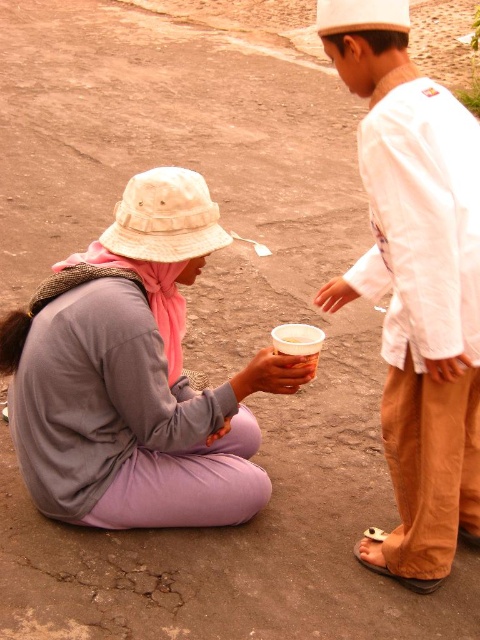
You are a delivery person who needs to deliver a package to the taller object between the purple fabric at lower left and the white cotton shirt at right. Which one should you deliver the package to?

The white cotton shirt at right is taller than the purple fabric at lower left, so you should deliver the package to the white cotton shirt at right.

You are a delivery person who needs to place a small package on the ground between the white cotton shirt at right and the white plastic cup at center. Based on their positions, where should you place the package?

The white cotton shirt at right is located above the white plastic cup at center, so you should place the package on the ground between them, closer to the white plastic cup at center since the shirt is elevated and the cup is lower.

You are a delivery person who needs to place a small package between the white cotton shirt at right and the white plastic cup at center. Based on their sizes, which object should you place the package closer to?

The white cotton shirt at right is wider than the white plastic cup at center, so you should place the package closer to the white plastic cup at center to ensure it fits properly.